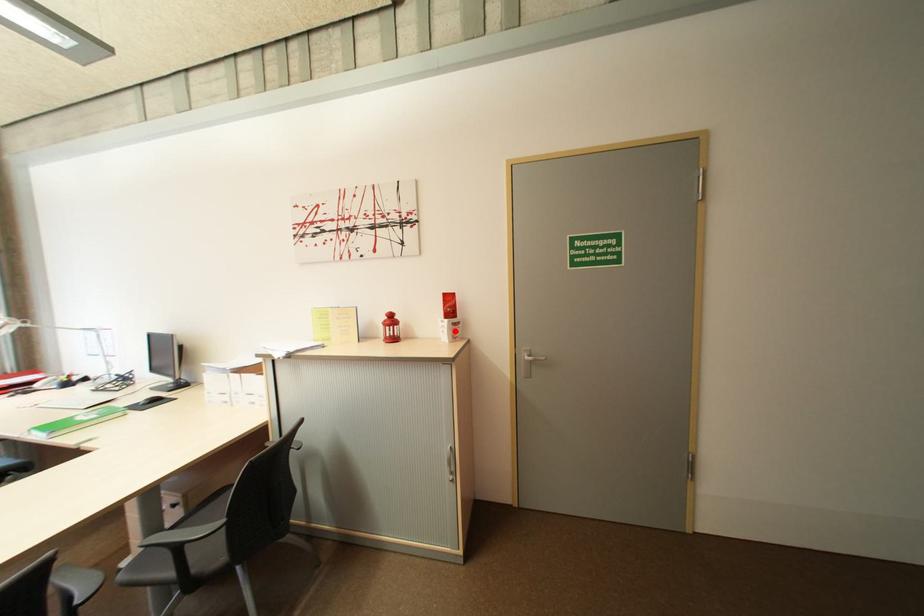
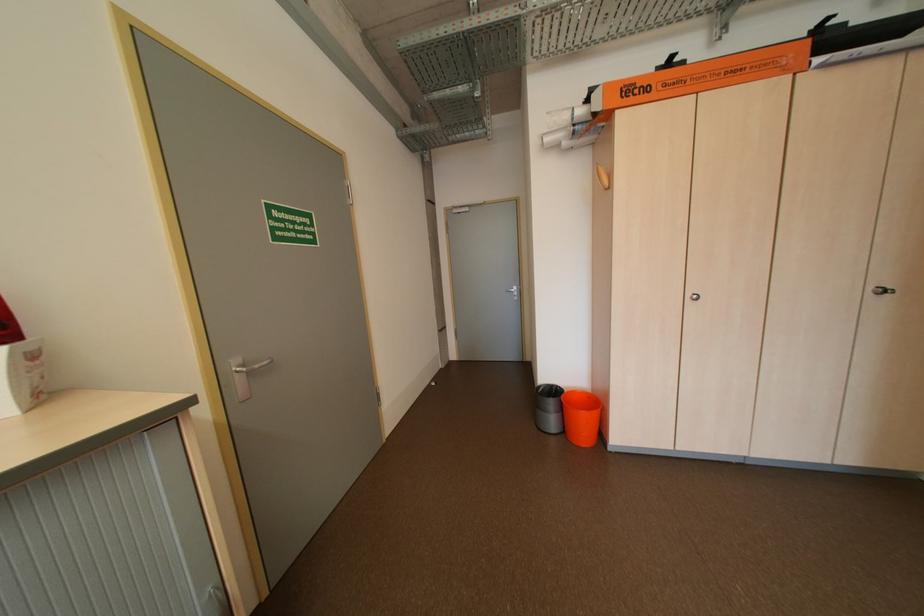
Find the pixel in the second image that matches the highlighted location in the first image.

(6, 383)